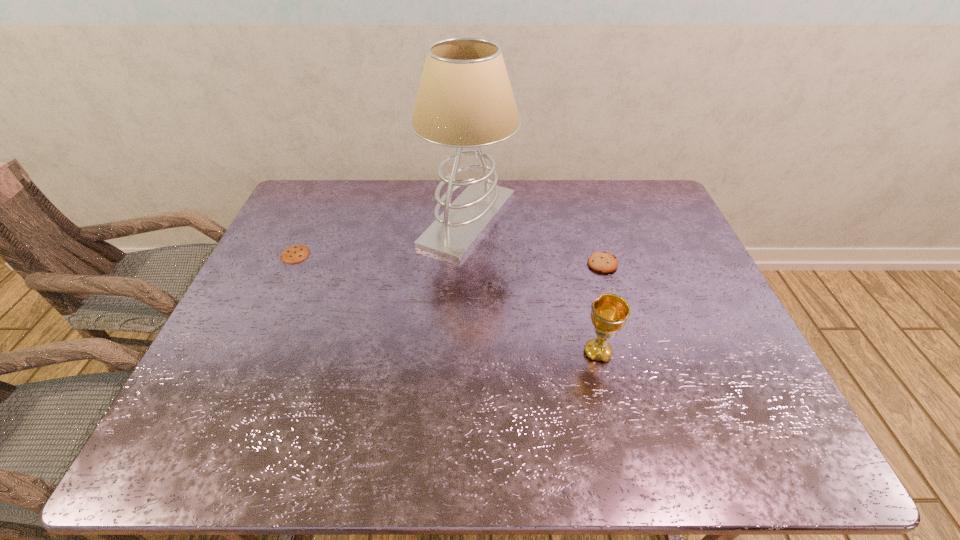
Where is `the third object from right to left`? The width and height of the screenshot is (960, 540). the third object from right to left is located at coordinates (465, 99).

In order to click on table lamp in this screenshot , I will do `click(465, 99)`.

At what (x,y) coordinates should I click in order to perform the action: click on chalice. Please return your answer as a coordinate pair (x, y). The image size is (960, 540). Looking at the image, I should click on (609, 313).

Find the location of a particular element. The image size is (960, 540). the second tallest object is located at coordinates (609, 313).

You are a GUI agent. You are given a task and a screenshot of the screen. Output one action in this format:
    pyautogui.click(x=<x>, y=<y>)
    Task: Click on the right cookie
    This screenshot has height=540, width=960.
    Given the screenshot: What is the action you would take?
    pyautogui.click(x=604, y=262)

Where is `the second shortest object`? the second shortest object is located at coordinates (604, 262).

Identify the location of the leftmost object. (296, 253).

At what (x,y) coordinates should I click in order to perform the action: click on the left cookie. Please return your answer as a coordinate pair (x, y). This screenshot has width=960, height=540. Looking at the image, I should click on click(x=296, y=253).

Identify the location of vacant position located on the front of the table lamp. (465, 333).

At what (x,y) coordinates should I click in order to perform the action: click on vacant region located on the back of the nearest object. Please return your answer as a coordinate pair (x, y). Looking at the image, I should click on (573, 245).